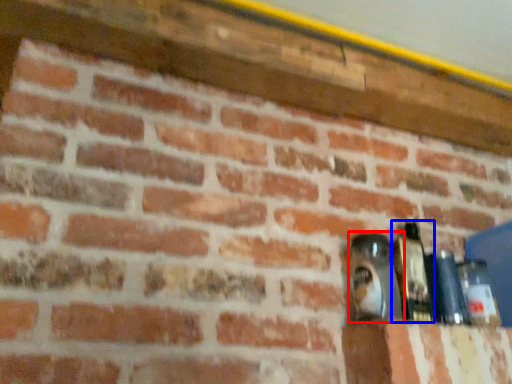
Question: Which point is closer to the camera, bottle (highlighted by a red box) or bottle (highlighted by a blue box)?

Choices:
 (A) bottle
 (B) bottle

Answer: (A)